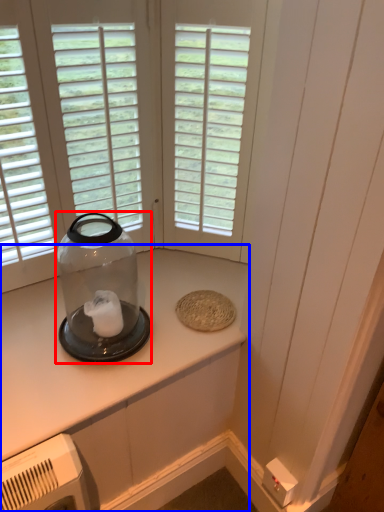
Question: Which of the following is the closest to the observer, glass bottle (highlighted by a red box) or countertop (highlighted by a blue box)?

Choices:
 (A) glass bottle
 (B) countertop

Answer: (A)